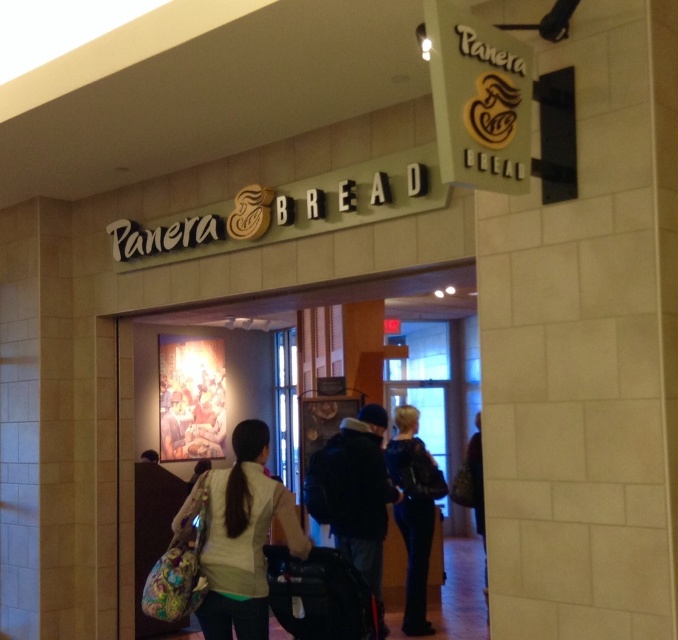
Question: Which point is closer to the camera taking this photo?

Choices:
 (A) (302, 602)
 (B) (428, 557)

Answer: (A)

Question: Which object appears farthest from the camera in this image?

Choices:
 (A) black fabric backpack at center
 (B) leather jacket at center
 (C) white fabric backpack at center

Answer: (B)

Question: Which is farther from the black fabric backpack at center?

Choices:
 (A) white fabric backpack at center
 (B) leather jacket at center

Answer: (B)

Question: Is white fabric backpack at center above leather jacket at center?

Choices:
 (A) no
 (B) yes

Answer: (B)

Question: Is black fabric backpack at center positioned in front of leather jacket at center?

Choices:
 (A) no
 (B) yes

Answer: (B)

Question: Is black fabric backpack at center further to camera compared to leather jacket at center?

Choices:
 (A) no
 (B) yes

Answer: (A)